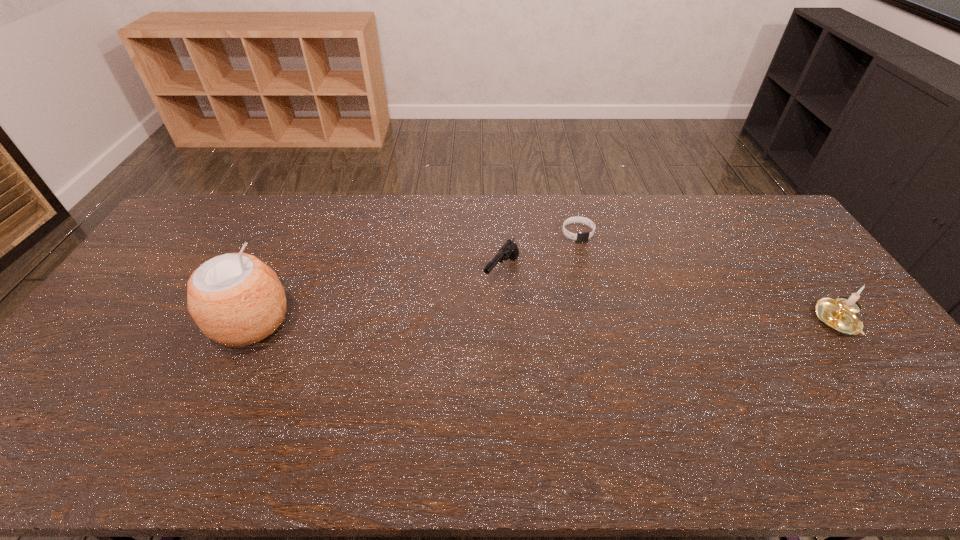
Locate an element on the screen. vacant space on the desktop that is between the tallest object and the second tallest object and is positioned on the outer surface of the third object from left to right is located at coordinates (622, 322).

What are the coordinates of `vacant spot on the desktop that is between the tallest object and the rightmost object and is positioned at the end of the barrel of the third tallest object` in the screenshot? It's located at (461, 322).